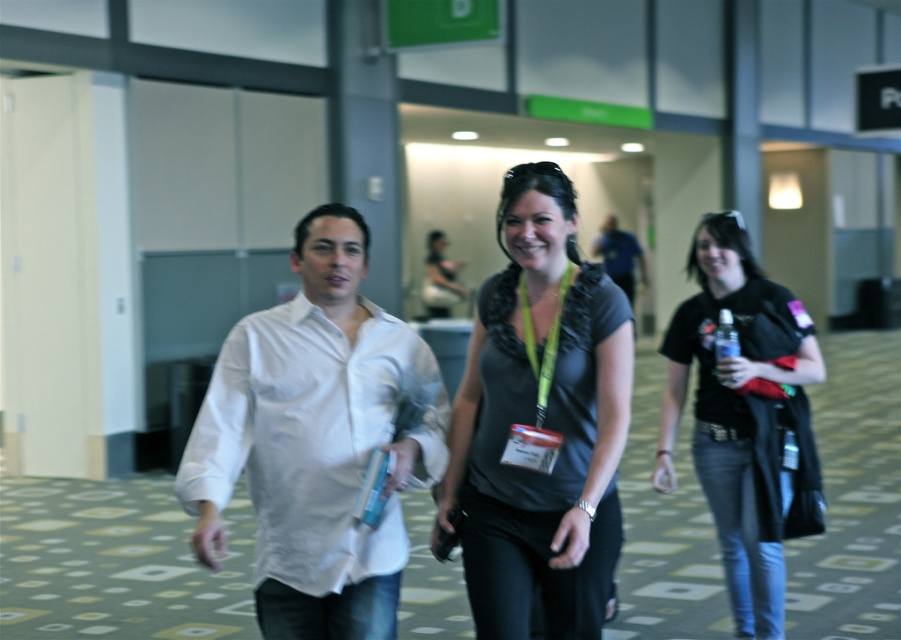
Question: Which of these objects is positioned closest to the black matte shirt at right?

Choices:
 (A) yellow fabric lanyard at center
 (B) white cotton shirt at center

Answer: (A)

Question: Among these points, which one is farthest from the camera?

Choices:
 (A) (257, 568)
 (B) (537, 384)

Answer: (B)

Question: Considering the relative positions of white cotton shirt at center and black matte shirt at right in the image provided, where is white cotton shirt at center located with respect to black matte shirt at right?

Choices:
 (A) below
 (B) above

Answer: (B)

Question: Is white cotton shirt at center below black matte shirt at right?

Choices:
 (A) yes
 (B) no

Answer: (B)

Question: Does black matte shirt at right come behind yellow fabric lanyard at center?

Choices:
 (A) no
 (B) yes

Answer: (B)

Question: Based on their relative distances, which object is farther from the white cotton shirt at center?

Choices:
 (A) black matte shirt at right
 (B) yellow fabric lanyard at center
 (C) matte black blouse at center

Answer: (A)